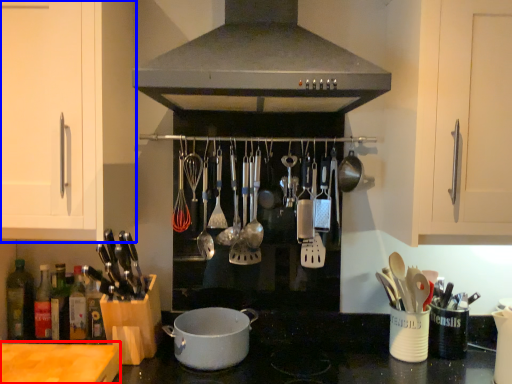
Question: Which object is further to the camera taking this photo, counter top (highlighted by a red box) or cabinetry (highlighted by a blue box)?

Choices:
 (A) counter top
 (B) cabinetry

Answer: (B)